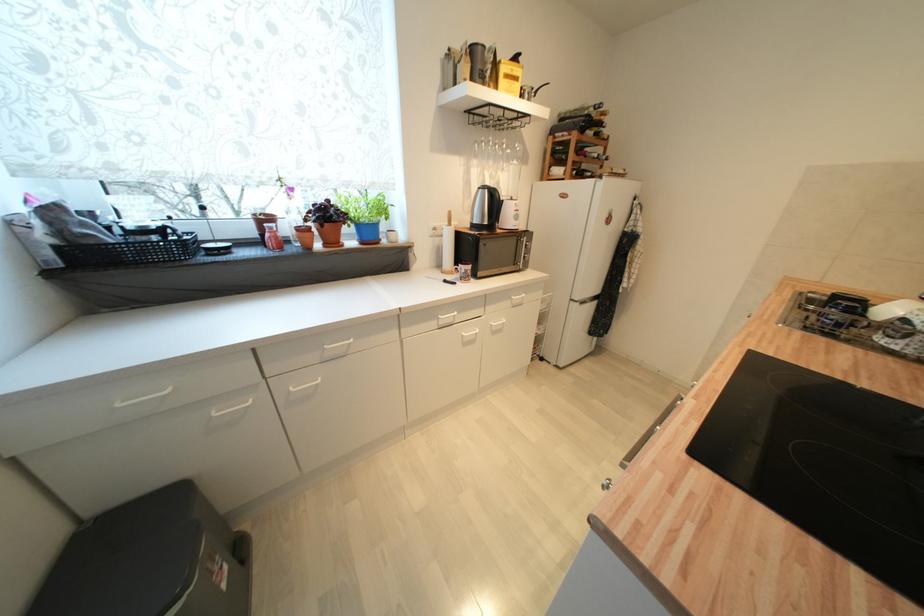
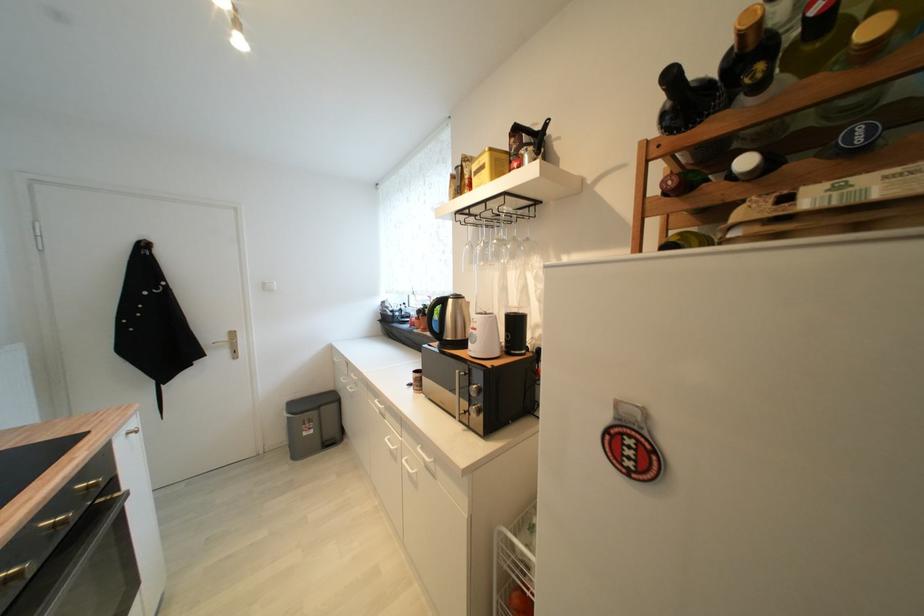
Locate, in the second image, the point that corresponds to pixel 515 74 in the first image.

(483, 169)